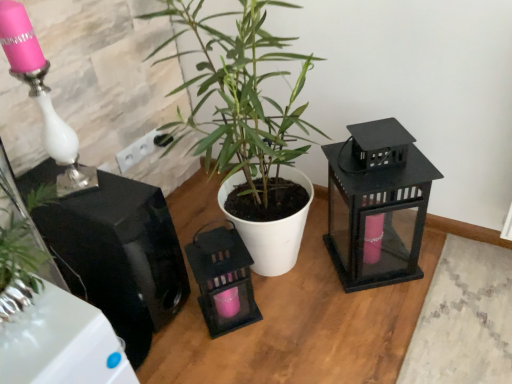
Find the location of `free spot in front of matte black lantern at right, acting as the first appliance starting from the right`. free spot in front of matte black lantern at right, acting as the first appliance starting from the right is located at coordinates (390, 317).